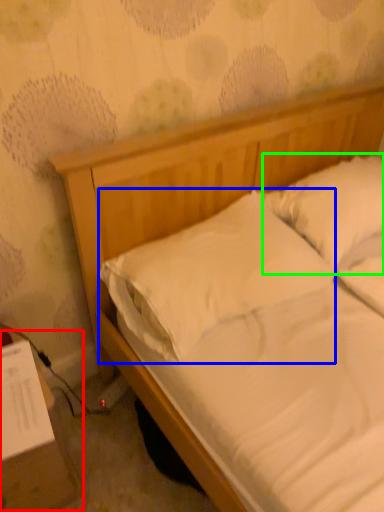
Question: Estimate the real-world distances between objects in this image. Which object is farther from table (highlighted by a red box), pillow (highlighted by a blue box) or pillow (highlighted by a green box)?

Choices:
 (A) pillow
 (B) pillow

Answer: (B)